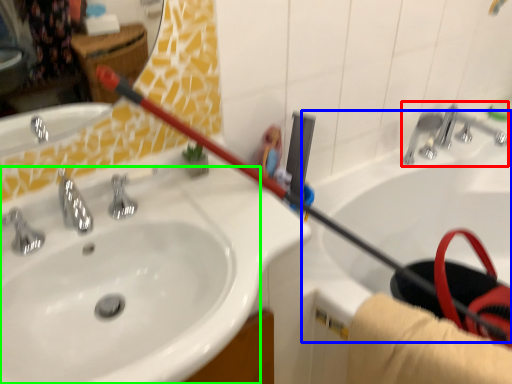
Question: Estimate the real-world distances between objects in this image. Which object is closer to plumbing fixture (highlighted by a red box), bath (highlighted by a blue box) or sink (highlighted by a green box)?

Choices:
 (A) bath
 (B) sink

Answer: (A)